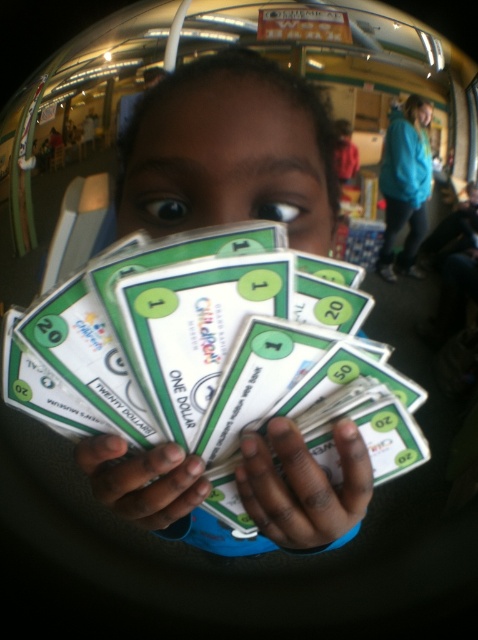
The width and height of the screenshot is (478, 640). What do you see at coordinates (213, 353) in the screenshot? I see `green paper money at center` at bounding box center [213, 353].

Identify the location of green paper money at center. (213, 353).

Does green paper money at center appear over white paper money at center?

Incorrect, green paper money at center is not positioned above white paper money at center.

Between green paper money at center and white paper money at center, which one has less height?

With less height is green paper money at center.

Which is behind, point (339, 413) or point (265, 205)?

Point (265, 205)

This screenshot has width=478, height=640. I want to click on green paper money at center, so coord(213,353).

Based on the photo, is blue fleece jacket at upper right further to camera compared to smooth skin face at center?

Yes, it is.

Which is behind, point (399, 218) or point (423, 115)?

The point (399, 218) is more distant.

Locate an element on the screen. This screenshot has width=478, height=640. blue fleece jacket at upper right is located at coordinates (403, 188).